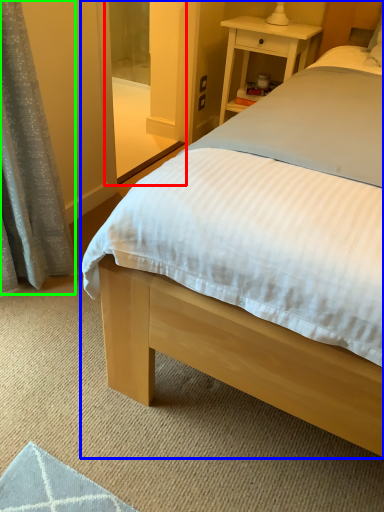
Question: Which object is positioned farthest from screen door (highlighted by a red box)? Select from bed (highlighted by a blue box) and curtain (highlighted by a green box).

Choices:
 (A) bed
 (B) curtain

Answer: (B)